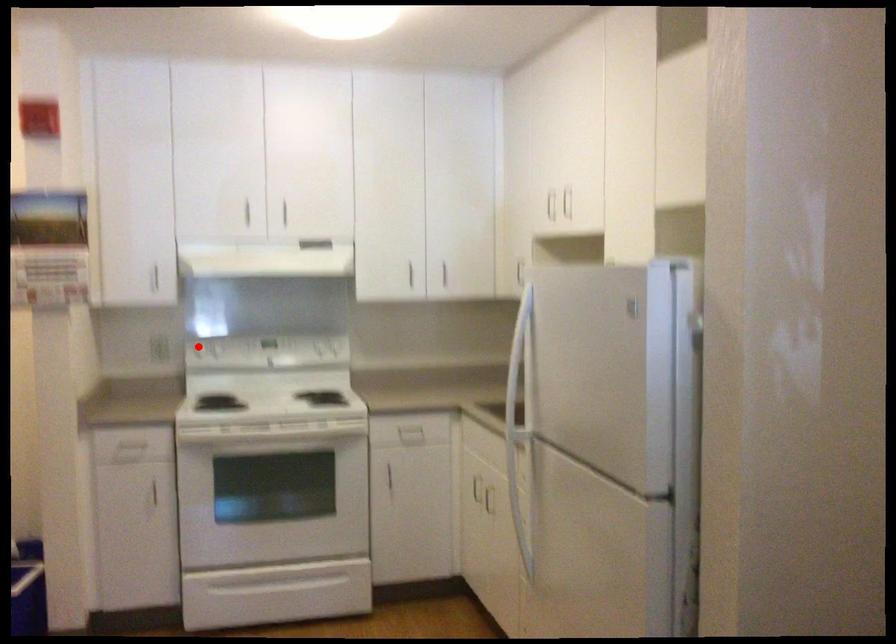
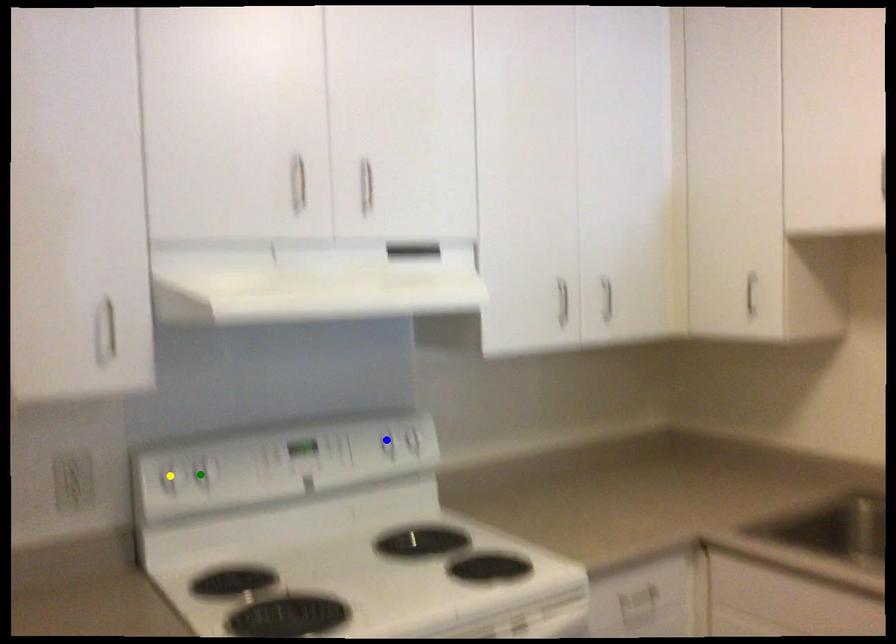
Question: I am providing you with two images of the same scene from different viewpoints. A red point is marked on the first image. You are given multiple points on the second image. Which spot in image 2 lines up with the point in image 1?

Choices:
 (A) yellow point
 (B) blue point
 (C) green point

Answer: (A)